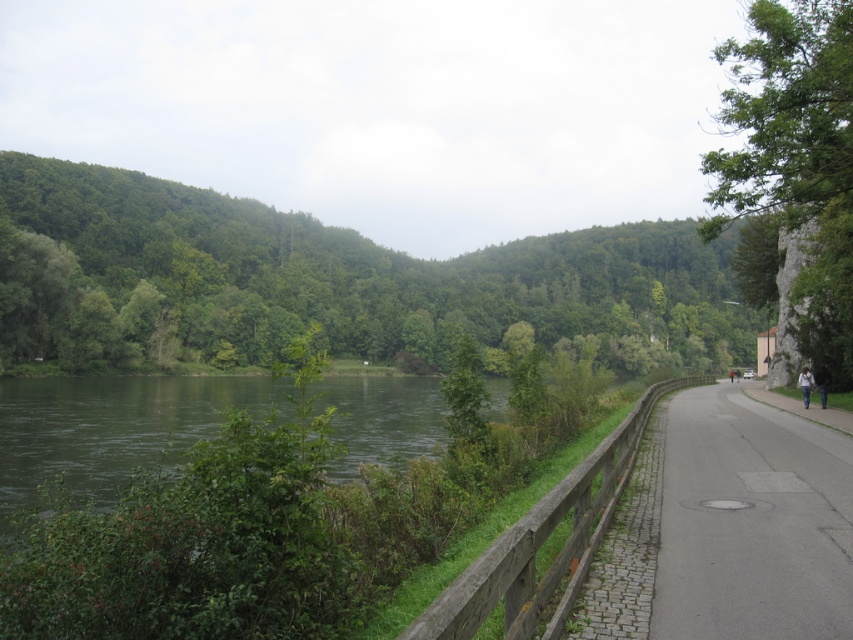
Question: Which object appears closest to the camera in this image?

Choices:
 (A) green water at center
 (B) gray asphalt road at right
 (C) wooden fence at center
 (D) green leafy tree at right

Answer: (C)

Question: Is green leafy tree at right to the left of green water at center from the viewer's perspective?

Choices:
 (A) yes
 (B) no

Answer: (B)

Question: Can you confirm if green leafy tree at right is bigger than wooden fence at center?

Choices:
 (A) no
 (B) yes

Answer: (B)

Question: Which of these objects is positioned farthest from the green leafy tree at center?

Choices:
 (A) green leafy tree at right
 (B) gray asphalt road at right
 (C) green water at center

Answer: (B)

Question: Can you confirm if gray asphalt road at right is positioned to the left of green leafy tree at right?

Choices:
 (A) yes
 (B) no

Answer: (A)

Question: Which object is the farthest from the wooden fence at center?

Choices:
 (A) green leafy tree at right
 (B) green water at center
 (C) green leafy tree at center
 (D) gray asphalt road at right

Answer: (C)